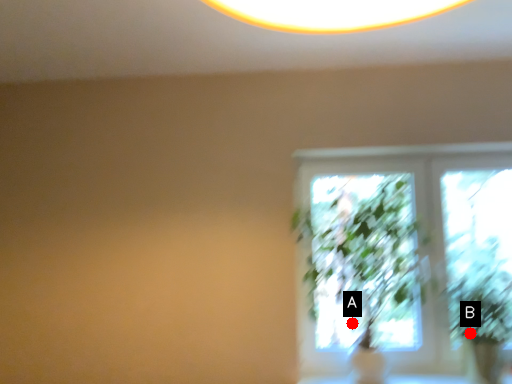
Question: Two points are circled on the image, labeled by A and B beside each circle. Which of the following is the farthest from the observer?

Choices:
 (A) A is further
 (B) B is further

Answer: (A)